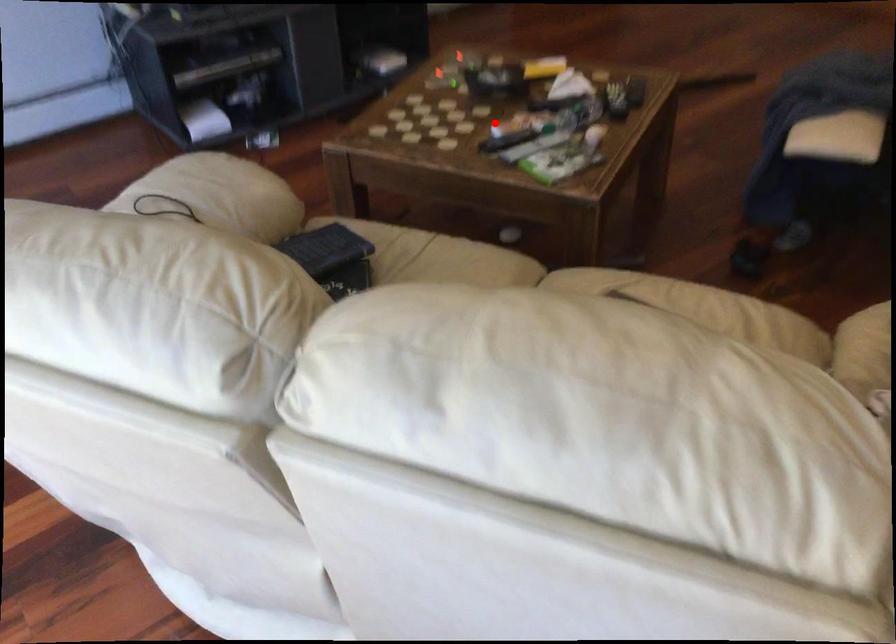
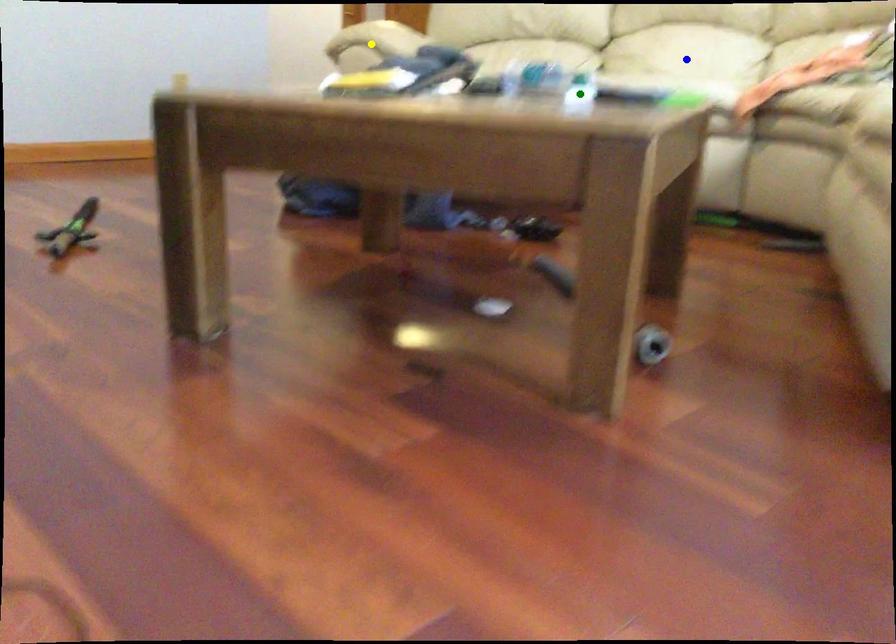
Question: I am providing you with two images of the same scene from different viewpoints. A red point is marked on the first image. You are given multiple points on the second image. Which point in image 2 is actually the same real-world point as the red point in image 1?

Choices:
 (A) yellow point
 (B) blue point
 (C) green point

Answer: (C)